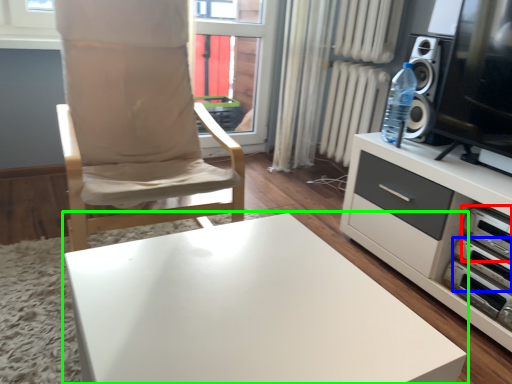
Question: Which is nearer to the appliance (highlighted by a red box)? appliance (highlighted by a blue box) or table (highlighted by a green box).

Choices:
 (A) appliance
 (B) table

Answer: (A)